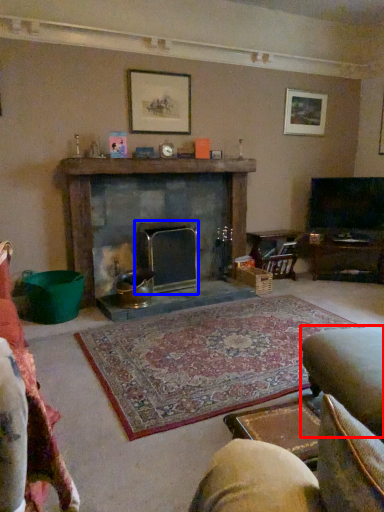
Question: Which object is further to the camera taking this photo, swivel chair (highlighted by a red box) or fireplace (highlighted by a blue box)?

Choices:
 (A) swivel chair
 (B) fireplace

Answer: (B)